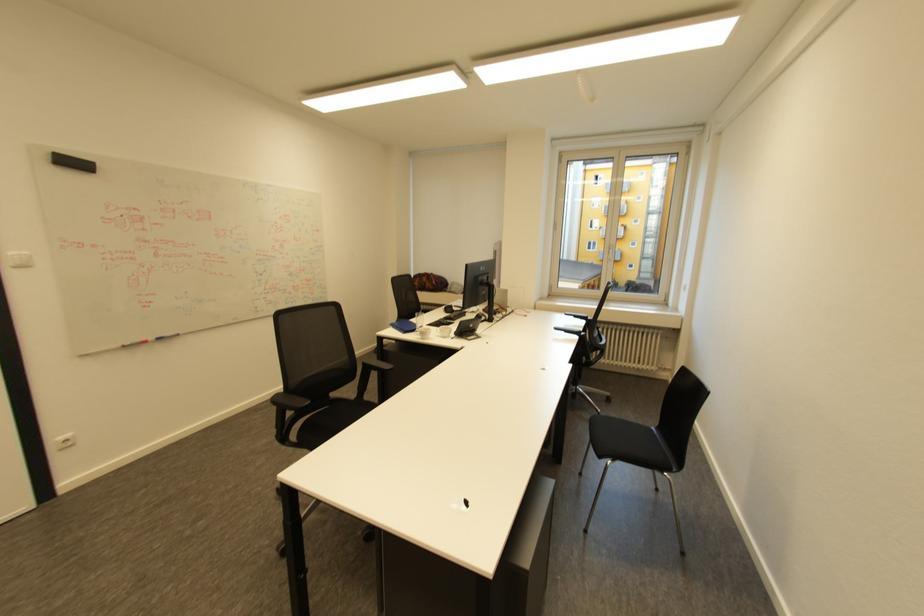
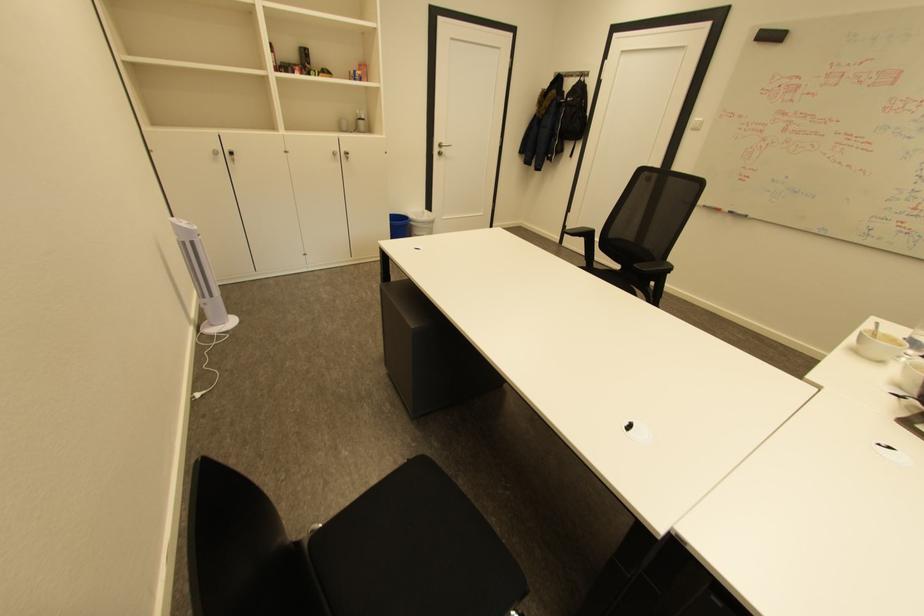
In the second image, find the point that corresponds to point 164,339 in the first image.

(737, 212)